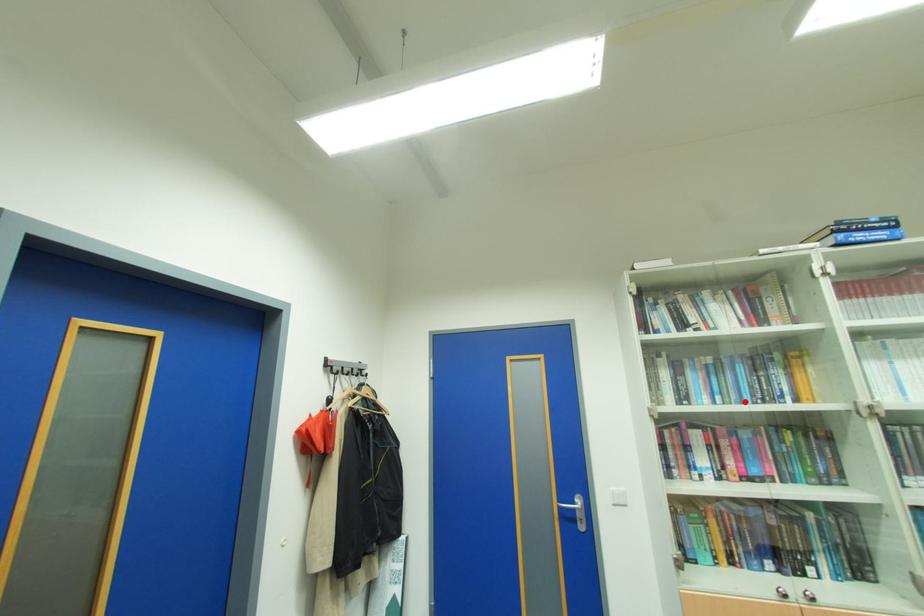
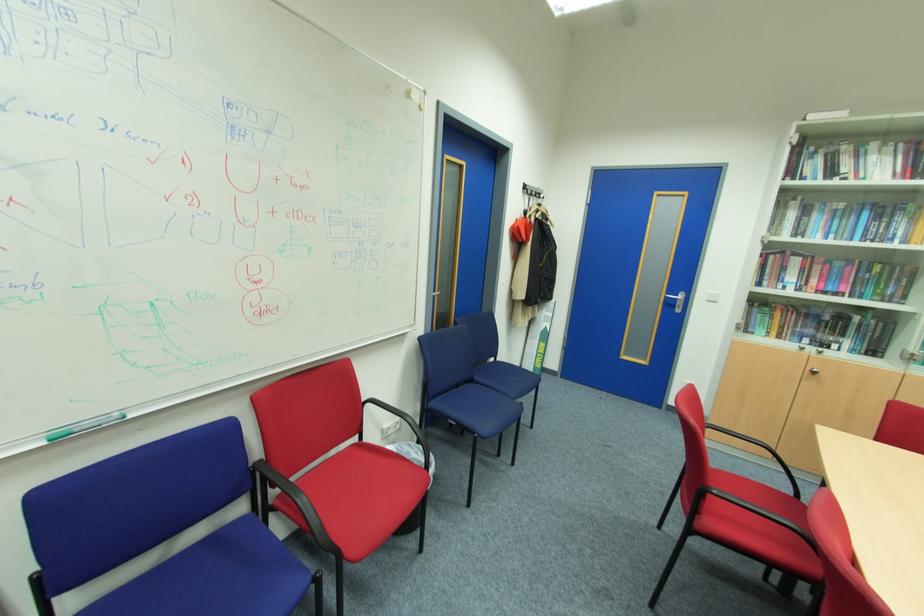
Find the pixel in the second image that matches the highlighted location in the first image.

(854, 240)